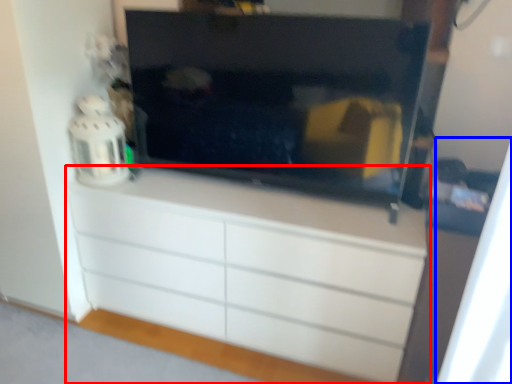
Question: Which point is closer to the camera, chest of drawers (highlighted by a red box) or curtain (highlighted by a blue box)?

Choices:
 (A) chest of drawers
 (B) curtain

Answer: (B)